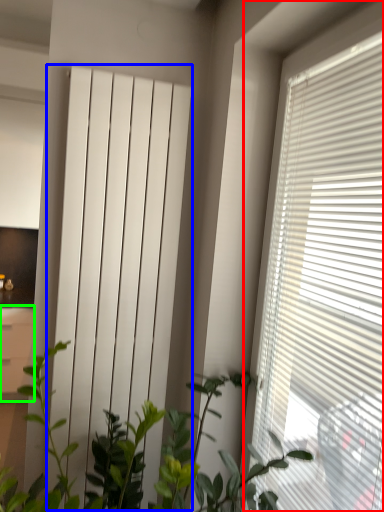
Question: Which object is the closest to the window blind (highlighted by a red box)? Choose among these: curtain (highlighted by a blue box) or file cabinet (highlighted by a green box).

Choices:
 (A) curtain
 (B) file cabinet

Answer: (A)